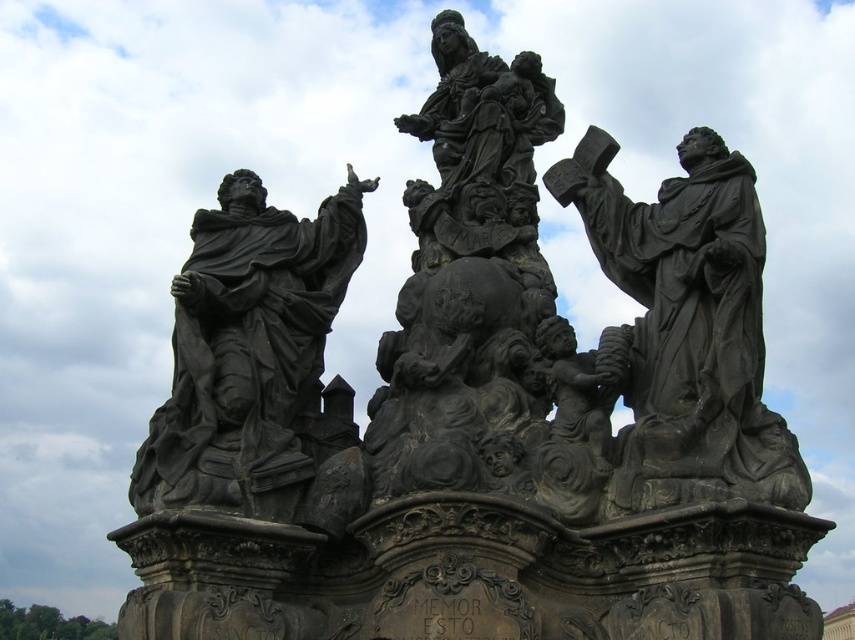
Based on the scene description, where is the matte black statue at right located in terms of its 2D coordinates?

The matte black statue at right is located at the 2D coordinates of point (685, 328).